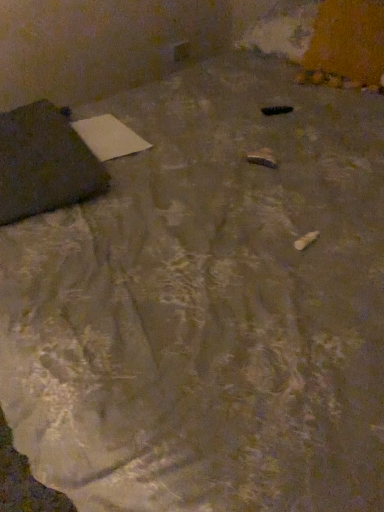
Question: Would you say matte black bag at left is a long distance from white paper at upper left?

Choices:
 (A) yes
 (B) no

Answer: (B)

Question: Is matte black bag at left in contact with white paper at upper left?

Choices:
 (A) no
 (B) yes

Answer: (A)

Question: Does matte black bag at left have a larger size compared to white paper at upper left?

Choices:
 (A) no
 (B) yes

Answer: (B)

Question: From a real-world perspective, is matte black bag at left physically below white paper at upper left?

Choices:
 (A) no
 (B) yes

Answer: (A)

Question: Can you confirm if matte black bag at left is taller than white paper at upper left?

Choices:
 (A) no
 (B) yes

Answer: (B)

Question: From the image's perspective, is matte black bag at left on white paper at upper left?

Choices:
 (A) yes
 (B) no

Answer: (B)

Question: From the image's perspective, does white paper at upper left appear higher than matte black bag at left?

Choices:
 (A) no
 (B) yes

Answer: (B)

Question: Can you confirm if white paper at upper left is shorter than matte black bag at left?

Choices:
 (A) no
 (B) yes

Answer: (B)

Question: Is white paper at upper left further to camera compared to matte black bag at left?

Choices:
 (A) no
 (B) yes

Answer: (B)

Question: Considering the relative sizes of white paper at upper left and matte black bag at left in the image provided, is white paper at upper left smaller than matte black bag at left?

Choices:
 (A) yes
 (B) no

Answer: (A)

Question: From a real-world perspective, does white paper at upper left sit lower than matte black bag at left?

Choices:
 (A) yes
 (B) no

Answer: (A)

Question: Is white paper at upper left closer to the viewer compared to matte black bag at left?

Choices:
 (A) no
 (B) yes

Answer: (A)

Question: Considering the relative positions of white paper at upper left and matte black bag at left in the image provided, is white paper at upper left to the left or to the right of matte black bag at left?

Choices:
 (A) right
 (B) left

Answer: (A)